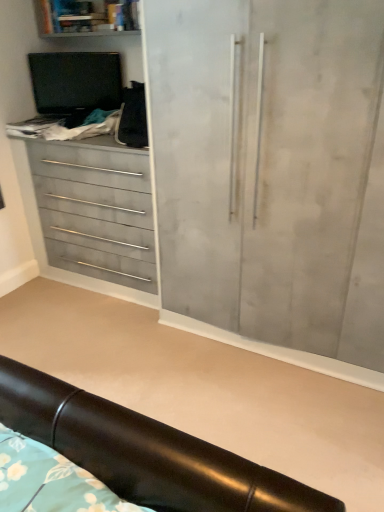
The width and height of the screenshot is (384, 512). Find the location of `blank space above black leather headboard at lower center (from a real-world perspective)`. blank space above black leather headboard at lower center (from a real-world perspective) is located at coordinates (138, 347).